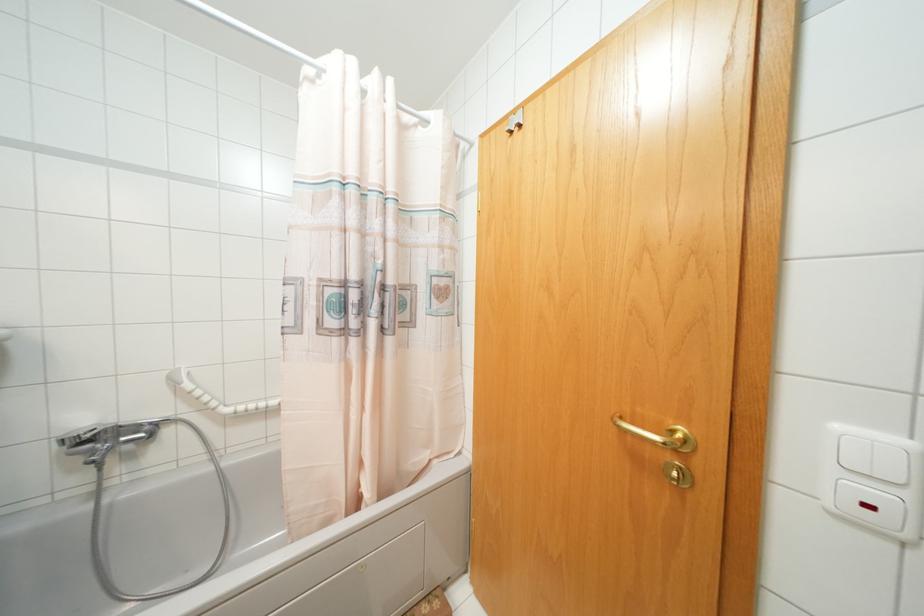
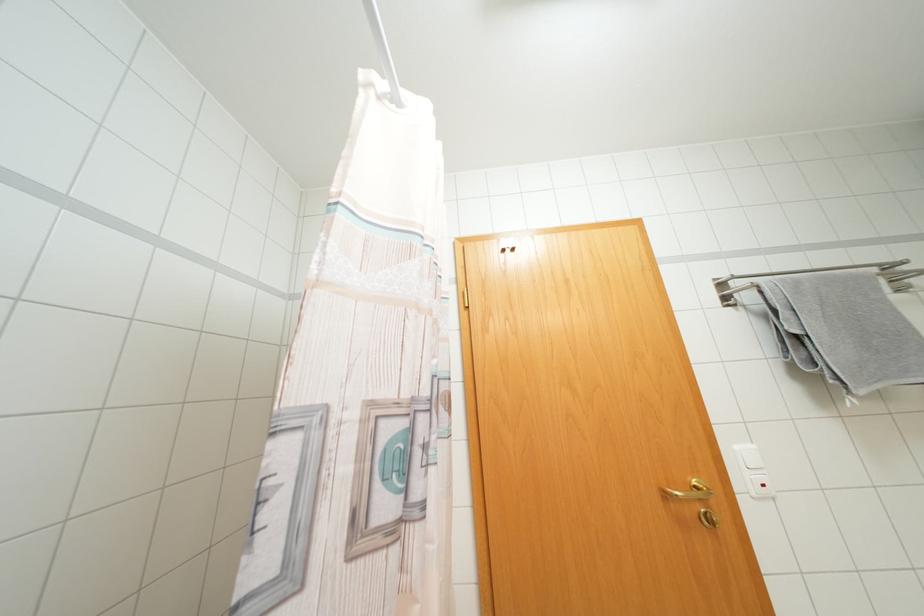
The first image is from the beginning of the video and the second image is from the end. How did the camera likely rotate when shooting the video?

The camera's rotation is toward right-up.